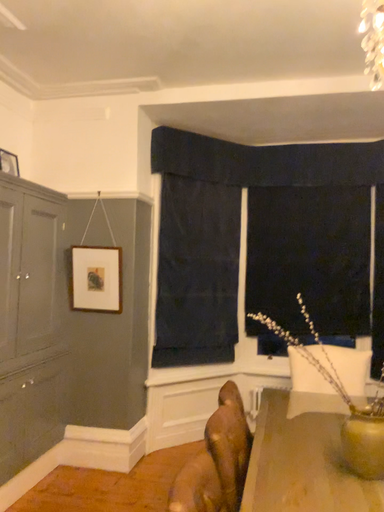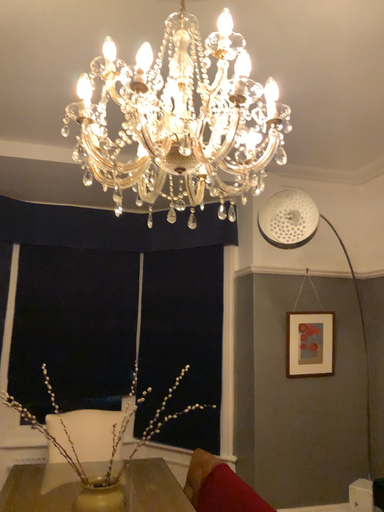
Question: Which way did the camera rotate in the video?

Choices:
 (A) rotated right
 (B) rotated left

Answer: (A)